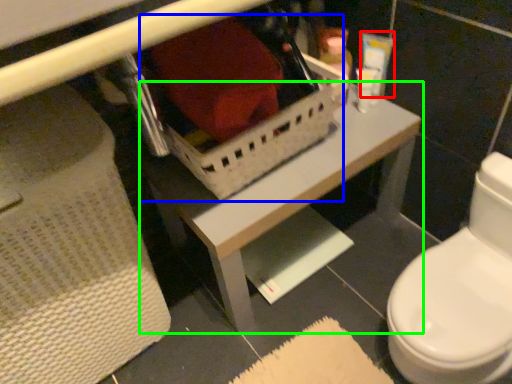
Question: Considering the real-world distances, which object is closest to toiletry (highlighted by a red box)? storage box (highlighted by a blue box) or table (highlighted by a green box).

Choices:
 (A) storage box
 (B) table

Answer: (A)